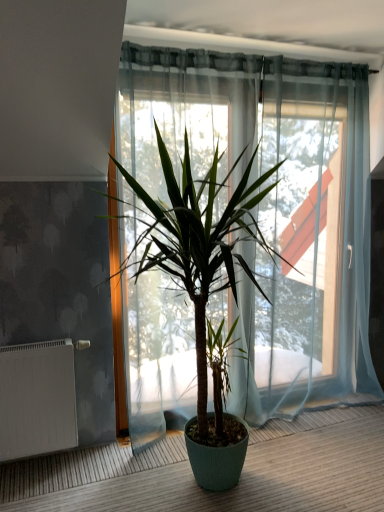
Find the location of a particular element. free spot below white matte radiator at lower left (from a real-world perspective) is located at coordinates (51, 459).